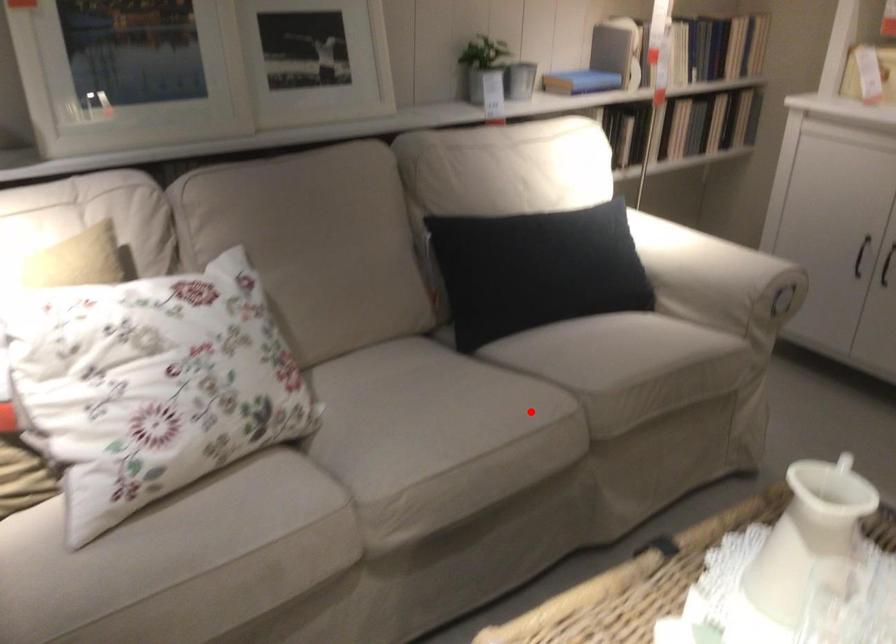
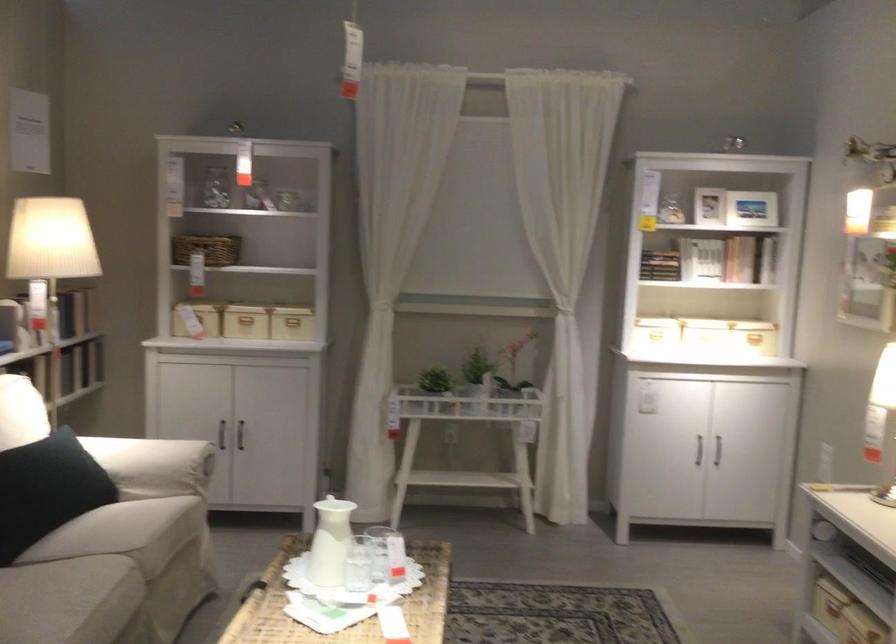
Question: I am providing you with two images of the same scene from different viewpoints. A red point is marked on the first image. Is the red point's position out of view in image 2?

Choices:
 (A) Yes
 (B) No

Answer: (B)